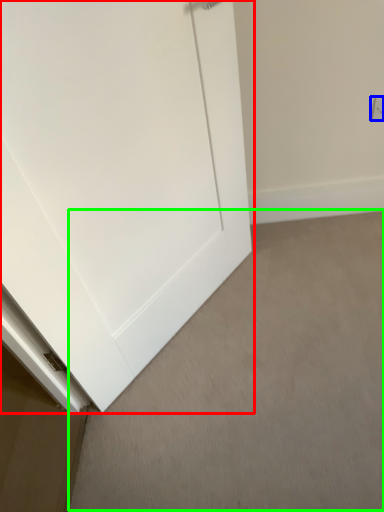
Question: Based on their relative distances, which object is nearer to door (highlighted by a red box)? Choose from electric outlet (highlighted by a blue box) and plain (highlighted by a green box).

Choices:
 (A) electric outlet
 (B) plain

Answer: (B)